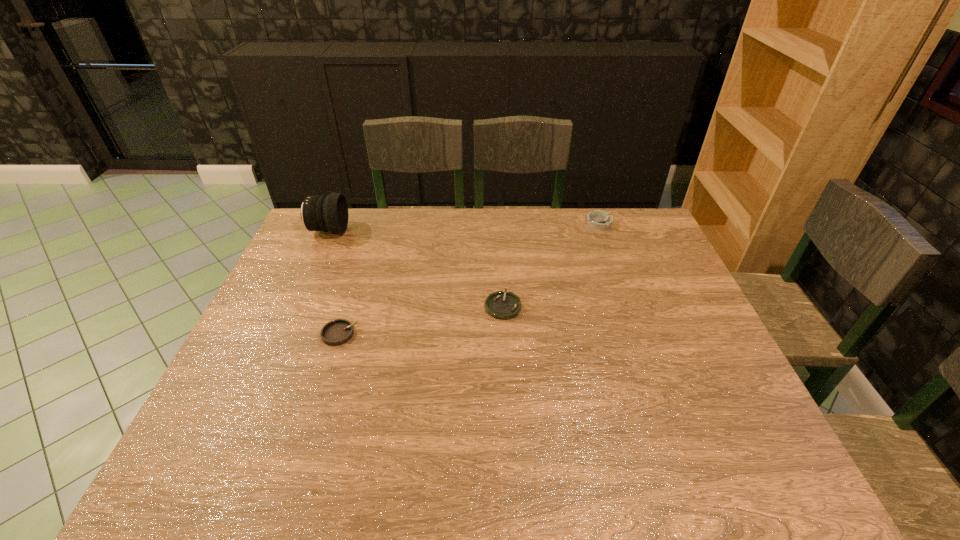
Where is `vacant space that satisfies the following two spatial constraints: 1. at the front element of the nearest object; 2. on the left side of the telephoto lens`? vacant space that satisfies the following two spatial constraints: 1. at the front element of the nearest object; 2. on the left side of the telephoto lens is located at coordinates (281, 334).

Identify the location of vacant space that satisfies the following two spatial constraints: 1. at the front element of the tallest object; 2. on the left side of the second object from left to right. (281, 334).

The width and height of the screenshot is (960, 540). I want to click on free space that satisfies the following two spatial constraints: 1. at the front element of the tallest object; 2. on the left side of the second nearest ashtray, so click(294, 306).

Identify the location of free spot that satisfies the following two spatial constraints: 1. at the front element of the leftmost object; 2. on the left side of the second ashtray from right to left. (294, 306).

The width and height of the screenshot is (960, 540). What are the coordinates of `free location that satisfies the following two spatial constraints: 1. at the front element of the third tallest object; 2. on the right side of the telephoto lens` in the screenshot? It's located at (281, 334).

Find the location of a particular element. vacant region that satisfies the following two spatial constraints: 1. at the front element of the tallest object; 2. on the back side of the shortest ashtray is located at coordinates (294, 306).

Find the location of a particular element. The height and width of the screenshot is (540, 960). free spot that satisfies the following two spatial constraints: 1. at the front element of the third object from right to left; 2. on the left side of the telephoto lens is located at coordinates (281, 334).

Identify the location of blank area in the image that satisfies the following two spatial constraints: 1. at the front element of the nearest ashtray; 2. on the right side of the tallest object. Image resolution: width=960 pixels, height=540 pixels. (281, 334).